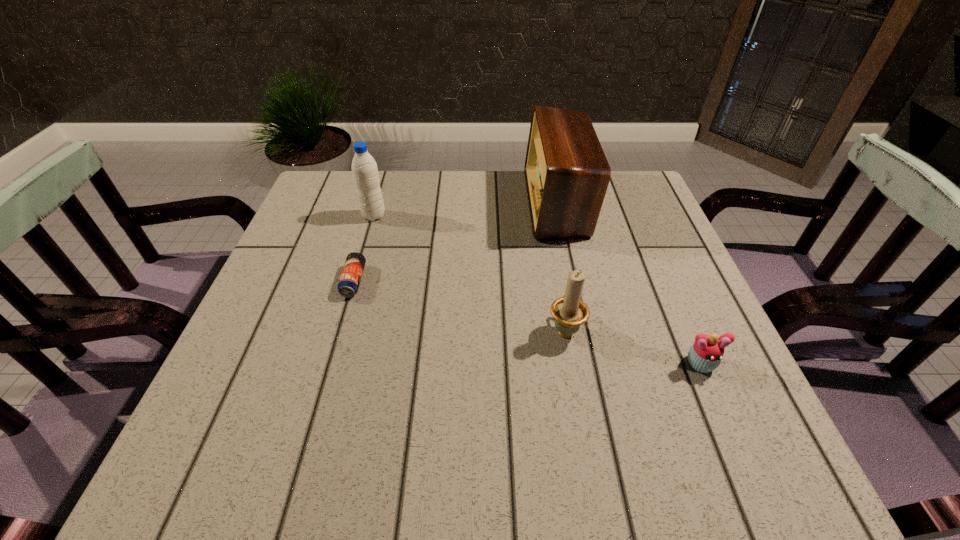
Where is `object that is at the right edge`? This screenshot has width=960, height=540. object that is at the right edge is located at coordinates (705, 355).

You are a GUI agent. You are given a task and a screenshot of the screen. Output one action in this format:
    pyautogui.click(x=<x>, y=<y>)
    Task: Click on the object present at the far left corner
    
    Given the screenshot: What is the action you would take?
    pyautogui.click(x=364, y=168)

In the image, there is a desktop. Where is `free space at the far edge`? The width and height of the screenshot is (960, 540). free space at the far edge is located at coordinates click(x=483, y=198).

This screenshot has height=540, width=960. I want to click on free region at the near edge of the desktop, so click(393, 441).

At what (x,y) coordinates should I click in order to perform the action: click on free spot at the left edge of the desktop. Please return your answer as a coordinate pair (x, y). Looking at the image, I should click on (325, 311).

Locate an element on the screen. The width and height of the screenshot is (960, 540). free location at the right edge of the desktop is located at coordinates (731, 357).

In order to click on free space at the far left corner of the desktop in this screenshot , I will do `click(348, 201)`.

In the image, there is a desktop. Find the location of `vacant space at the far right corner`. vacant space at the far right corner is located at coordinates (646, 206).

You are a GUI agent. You are given a task and a screenshot of the screen. Output one action in this format:
    pyautogui.click(x=<x>, y=<y>)
    Task: Click on the free region at the near right corner
    The image size is (960, 540).
    Given the screenshot: What is the action you would take?
    pyautogui.click(x=770, y=457)

Where is `vacant space that is in between the radio receiver and the third nearest object`? The width and height of the screenshot is (960, 540). vacant space that is in between the radio receiver and the third nearest object is located at coordinates (455, 242).